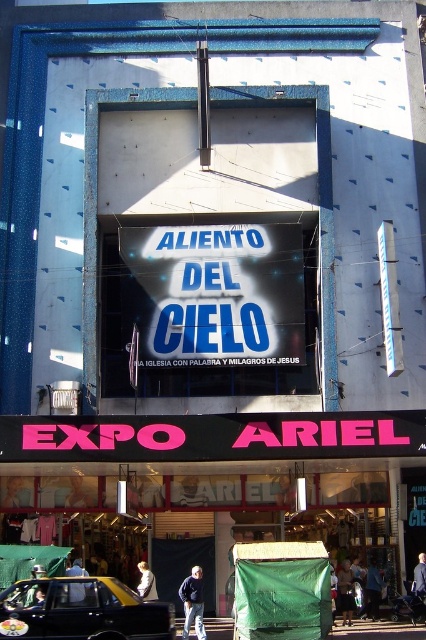
Question: Among these points, which one is farthest from the camera?

Choices:
 (A) (347, 586)
 (B) (278, 477)

Answer: (B)

Question: Does pink plastic sign at center appear on the right side of white glossy sign at center?

Choices:
 (A) yes
 (B) no

Answer: (B)

Question: Is dark blue jacket at center to the right of green fabric bag at center from the viewer's perspective?

Choices:
 (A) no
 (B) yes

Answer: (A)

Question: Can you confirm if green fabric bag at center is positioned to the left of light brown leather jacket at lower left?

Choices:
 (A) yes
 (B) no

Answer: (B)

Question: Which is nearer to the green fabric bag at center?

Choices:
 (A) dark blue jacket at center
 (B) light brown leather jacket at lower left

Answer: (A)

Question: Which point appears closest to the camera in this image?

Choices:
 (A) (126, 602)
 (B) (373, 616)

Answer: (A)